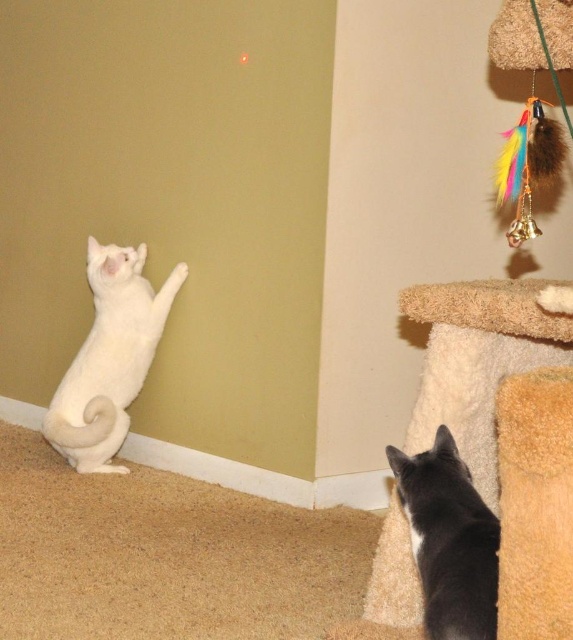
Question: Which point is closer to the camera taking this photo?

Choices:
 (A) (119, 385)
 (B) (464, 497)

Answer: (B)

Question: Where is white fur cat at left located in relation to black fur cat at lower right in the image?

Choices:
 (A) left
 (B) right

Answer: (A)

Question: Is white fur cat at left positioned before black fur cat at lower right?

Choices:
 (A) yes
 (B) no

Answer: (B)

Question: Does white fur cat at left appear over black fur cat at lower right?

Choices:
 (A) no
 (B) yes

Answer: (B)

Question: Among these objects, which one is nearest to the camera?

Choices:
 (A) white fur cat at left
 (B) black fur cat at lower right

Answer: (B)